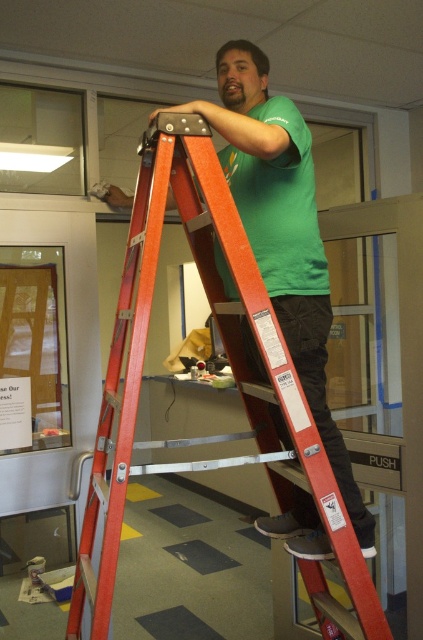
Question: Is orange metallic ladder at center in front of wooden bulletin board at left?

Choices:
 (A) yes
 (B) no

Answer: (A)

Question: Does orange metallic ladder at center appear under wooden bulletin board at left?

Choices:
 (A) yes
 (B) no

Answer: (A)

Question: Which point is farther to the camera?

Choices:
 (A) (41, 298)
 (B) (192, 232)

Answer: (A)

Question: Which point is farther from the camera taking this photo?

Choices:
 (A) (22, 250)
 (B) (91, 513)

Answer: (A)

Question: Is orange metallic ladder at center above wooden bulletin board at left?

Choices:
 (A) yes
 (B) no

Answer: (B)

Question: Which of the following is the farthest from the observer?

Choices:
 (A) orange metallic ladder at center
 (B) wooden bulletin board at left

Answer: (B)